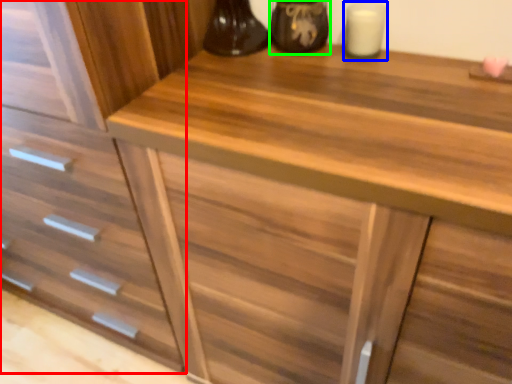
Question: Which object is the closest to the drawer (highlighted by a red box)? Choose among these: candle holder (highlighted by a blue box) or appliance (highlighted by a green box).

Choices:
 (A) candle holder
 (B) appliance

Answer: (B)